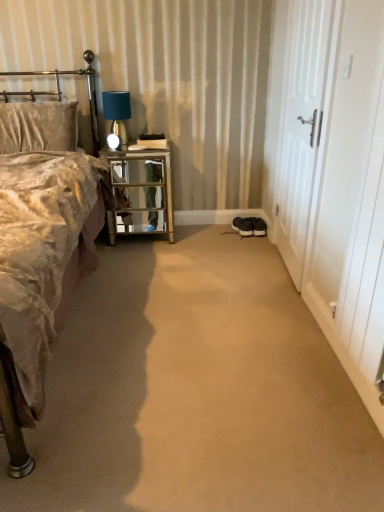
At what (x,y) coordinates should I click in order to perform the action: click on blank space to the left of white wooden door at right, the 1th screen door from the back. Please return your answer as a coordinate pair (x, y). This screenshot has height=512, width=384. Looking at the image, I should click on (231, 257).